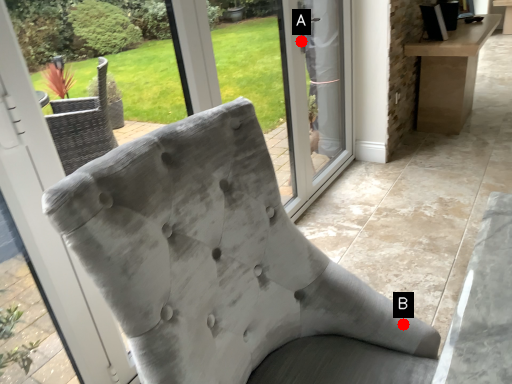
Question: Two points are circled on the image, labeled by A and B beside each circle. Which point is farther from the camera taking this photo?

Choices:
 (A) A is further
 (B) B is further

Answer: (A)